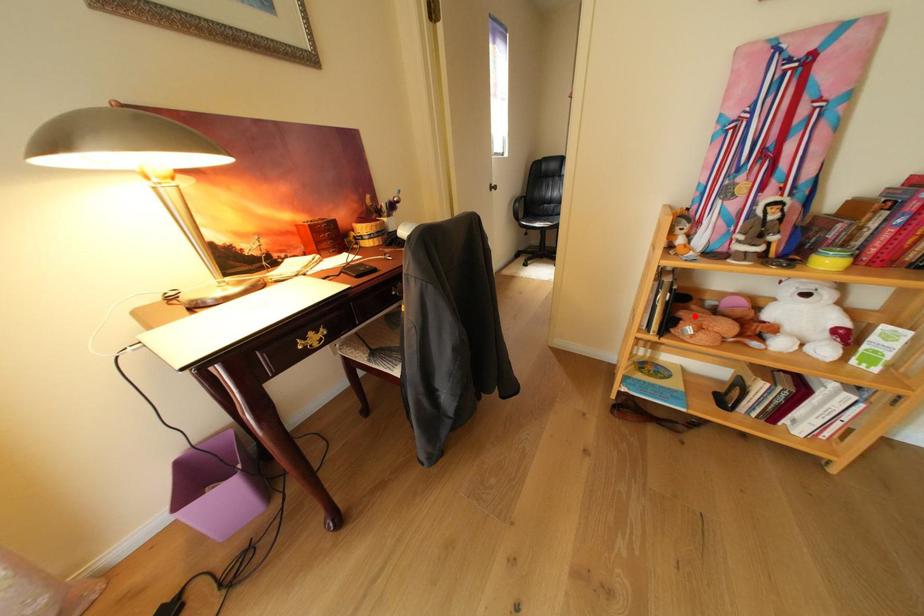
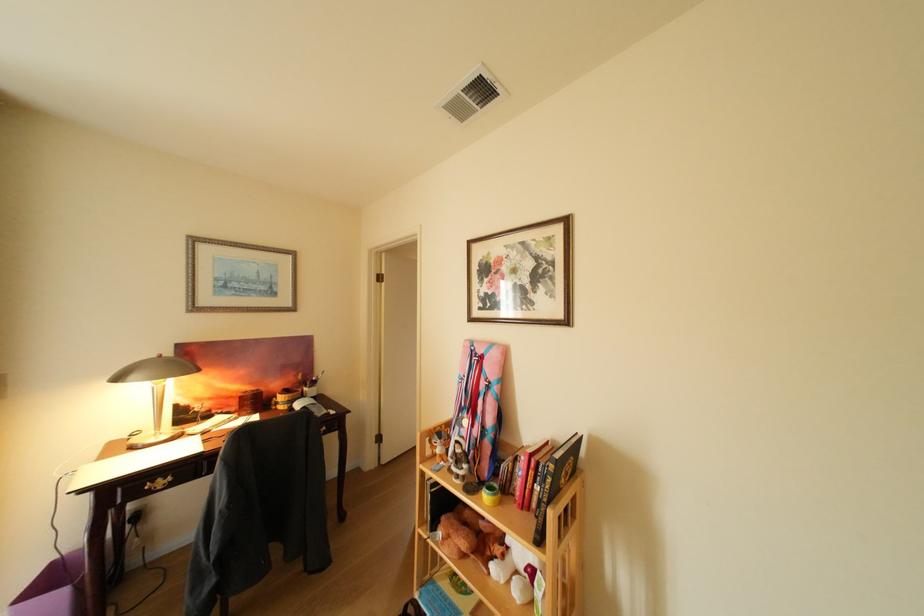
The point at the highlighted location is marked in the first image. Where is the corresponding point in the second image?

(456, 519)